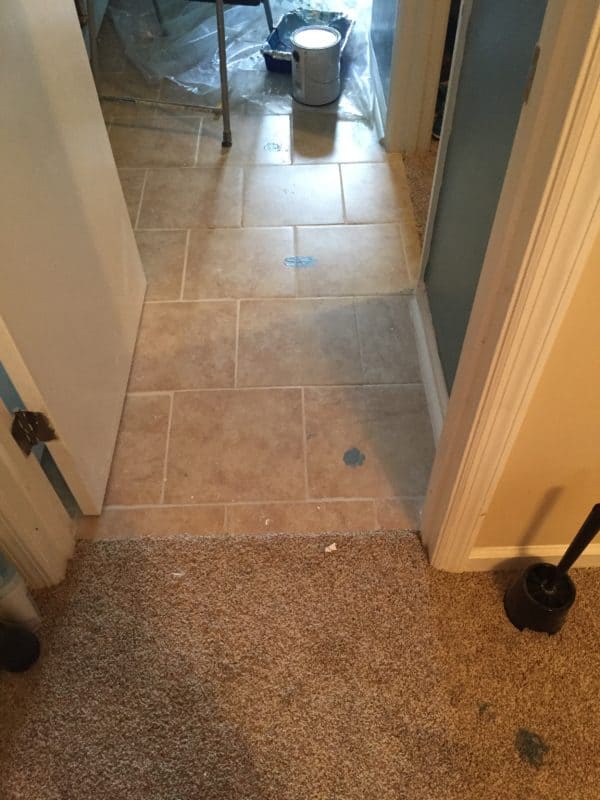
The width and height of the screenshot is (600, 800). I want to click on beige grout, so click(317, 498).